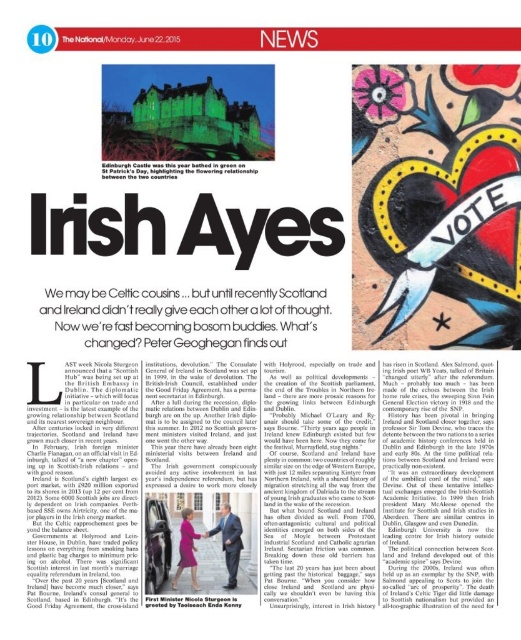
Does smooth leather shoes at lower center appear on the left side of matte purple dress at center?

No, smooth leather shoes at lower center is not to the left of matte purple dress at center.

Which is behind, point (220, 520) or point (202, 536)?

Positioned behind is point (220, 520).

Which is in front, point (232, 564) or point (190, 513)?

Point (232, 564)

What are the coordinates of `smooth leather shoes at lower center` in the screenshot? It's located at (229, 541).

Between point (440, 301) and point (230, 525), which one is positioned in front?

Point (440, 301)

Where is `vivid acrylic heart at center`? Image resolution: width=521 pixels, height=640 pixels. vivid acrylic heart at center is located at coordinates (437, 204).

Does vivid acrylic heart at center have a lesser height compared to matte purple dress at center?

No.

Which is above, vivid acrylic heart at center or matte purple dress at center?

vivid acrylic heart at center

Who is more forward, [452,236] or [193,564]?

Point [193,564] is more forward.

Image resolution: width=521 pixels, height=640 pixels. I want to click on vivid acrylic heart at center, so 437,204.